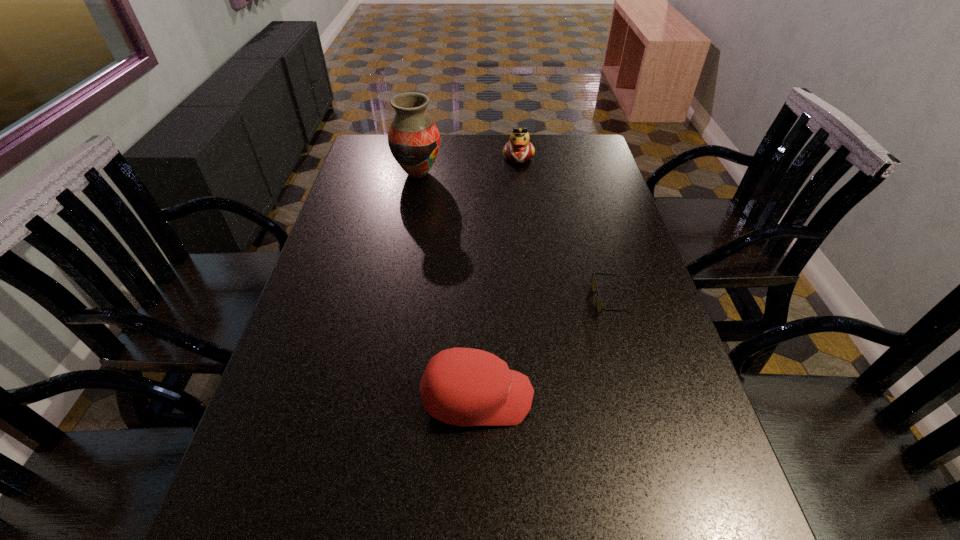
You are a GUI agent. You are given a task and a screenshot of the screen. Output one action in this format:
    pyautogui.click(x=<x>, y=<y>)
    Task: Click on the free space located 0.210m on the front-facing side of the sunglasses
    The height and width of the screenshot is (540, 960).
    Given the screenshot: What is the action you would take?
    pyautogui.click(x=512, y=300)

Where is `free space located 0.310m on the front-facing side of the sunglasses`? free space located 0.310m on the front-facing side of the sunglasses is located at coordinates (472, 300).

I want to click on free space located on the front-facing side of the sunglasses, so click(452, 300).

Locate an element on the screen. This screenshot has height=540, width=960. vase at the far edge is located at coordinates (414, 140).

I want to click on duck located at the far edge, so click(518, 149).

I want to click on object present at the left edge, so point(414,140).

Locate an element on the screen. The width and height of the screenshot is (960, 540). object at the right edge is located at coordinates (599, 305).

Identify the location of object that is at the far left corner. (414, 140).

This screenshot has height=540, width=960. In the image, there is a desktop. What are the coordinates of `vacant space at the far edge` in the screenshot? It's located at (468, 158).

In the image, there is a desktop. Where is `free space at the left edge`? free space at the left edge is located at coordinates (372, 248).